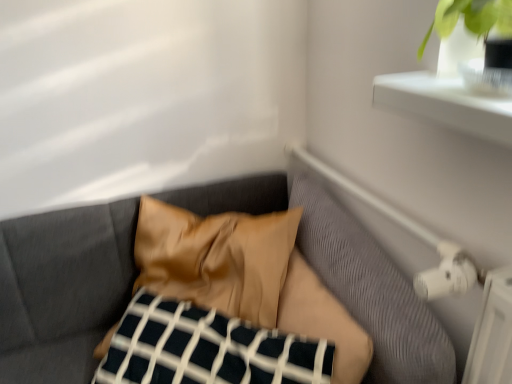
This screenshot has width=512, height=384. In order to click on matte brown pillow at center in this screenshot , I will do `click(63, 289)`.

Measure the distance between matte brown pillow at center and camera.

matte brown pillow at center and camera are 25.79 inches apart.

What do you see at coordinates (63, 289) in the screenshot? I see `matte brown pillow at center` at bounding box center [63, 289].

I want to click on matte brown pillow at center, so click(63, 289).